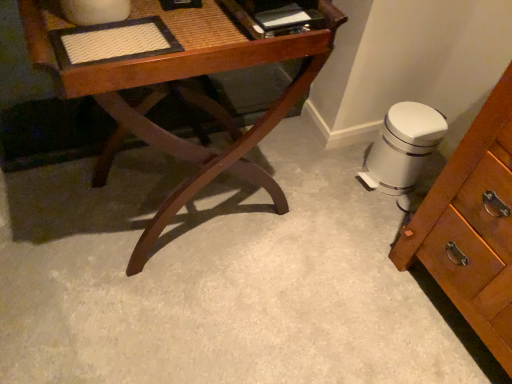
At what (x,y) coordinates should I click in order to perform the action: click on free space in front of white glossy trash can at lower right. Please return your answer as a coordinate pair (x, y). Looking at the image, I should click on (375, 206).